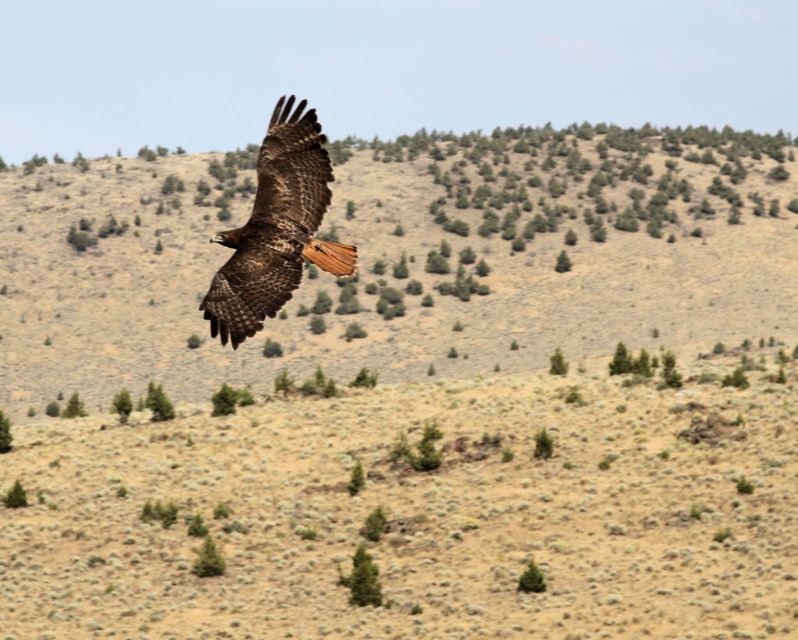
You are a hiker lost in the desert and see the green textured tree at lower center and the green leafy tree at lower left. Which tree would you approach first if you want to find shade quickly?

The green leafy tree at lower left has a greater width than the green textured tree at lower center, so it provides more shade and would be the better choice to approach first.

You are a birdwatcher trying to capture a photo of the brown feathered eagle at center. You notice the green textured tree at lower center might block your view. Can you determine if the eagle is wider than the tree?

The brown feathered eagle at center might be wider than green textured tree at lower center according to the description, so there is a possibility that the eagle is wider and might not be fully blocked by the tree.